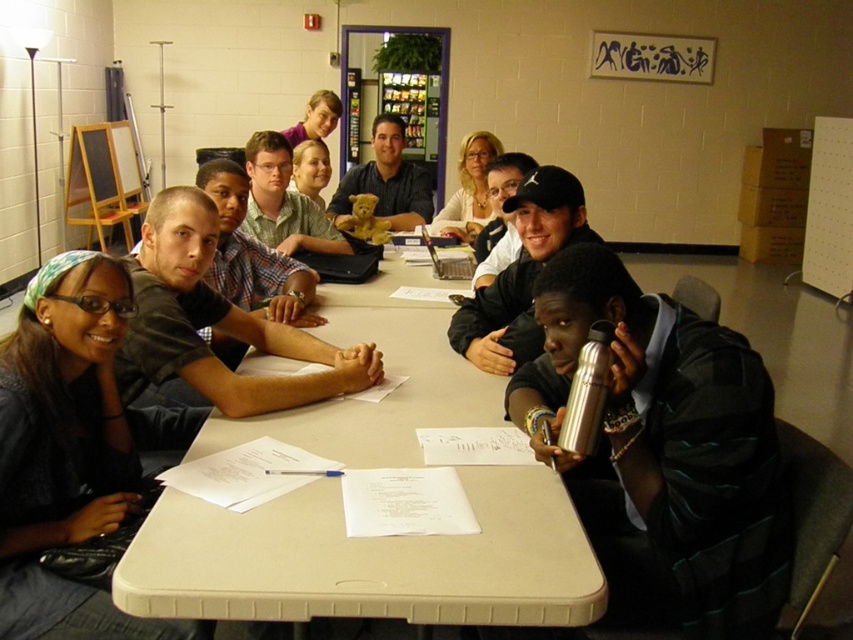
Is silver metallic thermos at lower right thinner than wooden easel at upper left?

Incorrect, silver metallic thermos at lower right's width is not less than wooden easel at upper left's.

Does silver metallic thermos at lower right have a smaller size compared to wooden easel at upper left?

Yes, silver metallic thermos at lower right is smaller than wooden easel at upper left.

Who is more distant from viewer, (779, 580) or (103, 172)?

Positioned behind is point (103, 172).

Find the location of a particular element. This screenshot has width=853, height=640. silver metallic thermos at lower right is located at coordinates (665, 452).

Is point (722, 525) positioned behind point (305, 138)?

No, it is in front of (305, 138).

Can you confirm if silver metallic thermos at lower right is wider than matte brown teddy bear at upper center?

Indeed, silver metallic thermos at lower right has a greater width compared to matte brown teddy bear at upper center.

Which is behind, point (747, 440) or point (299, 124)?

The point (299, 124) is more distant.

Locate an element on the screen. This screenshot has width=853, height=640. silver metallic thermos at lower right is located at coordinates [x=665, y=452].

Between point (691, 636) and point (492, 138), which one is positioned behind?

The point (492, 138) is behind.

Does silver metallic thermos at lower right have a lesser width compared to matte white blouse at upper center?

No, silver metallic thermos at lower right is not thinner than matte white blouse at upper center.

Where is `silver metallic thermos at lower right`? The width and height of the screenshot is (853, 640). silver metallic thermos at lower right is located at coordinates (665, 452).